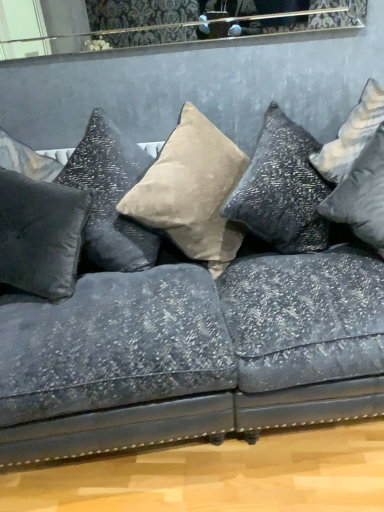
Question: From a real-world perspective, is satin black pillow at left, the fourth pillow in the right-to-left sequence, positioned under silver metallic pillow at right, which is counted as the fourth pillow, starting from the left, based on gravity?

Choices:
 (A) no
 (B) yes

Answer: (A)

Question: Is satin black pillow at left, the fourth pillow in the right-to-left sequence, bigger than silver metallic pillow at right, which appears as the 1th pillow when viewed from the right?

Choices:
 (A) yes
 (B) no

Answer: (A)

Question: From the image's perspective, is satin black pillow at left, which is counted as the first pillow, starting from the left, located above silver metallic pillow at right, which is counted as the fourth pillow, starting from the left?

Choices:
 (A) yes
 (B) no

Answer: (B)

Question: Can you confirm if satin black pillow at left, the fourth pillow in the right-to-left sequence, is smaller than silver metallic pillow at right, which appears as the 1th pillow when viewed from the right?

Choices:
 (A) yes
 (B) no

Answer: (B)

Question: Considering the relative sizes of satin black pillow at left, which is counted as the first pillow, starting from the left, and silver metallic pillow at right, which is counted as the fourth pillow, starting from the left, in the image provided, is satin black pillow at left, which is counted as the first pillow, starting from the left, wider than silver metallic pillow at right, which is counted as the fourth pillow, starting from the left,?

Choices:
 (A) no
 (B) yes

Answer: (A)

Question: Is silver metallic pillow at right, which is counted as the fourth pillow, starting from the left, to the left or to the right of suede beige pillow at center, which appears as the 2th pillow when viewed from the right, in the image?

Choices:
 (A) left
 (B) right

Answer: (B)

Question: Is silver metallic pillow at right, which is counted as the fourth pillow, starting from the left, wider or thinner than suede beige pillow at center, which appears as the 2th pillow when viewed from the right?

Choices:
 (A) thin
 (B) wide

Answer: (B)

Question: From a real-world perspective, is silver metallic pillow at right, which is counted as the fourth pillow, starting from the left, above or below suede beige pillow at center, which appears as the 2th pillow when viewed from the right?

Choices:
 (A) below
 (B) above

Answer: (A)

Question: Is silver metallic pillow at right, which is counted as the fourth pillow, starting from the left, spatially inside suede beige pillow at center, which appears as the 2th pillow when viewed from the right, or outside of it?

Choices:
 (A) inside
 (B) outside

Answer: (B)

Question: From the image's perspective, relative to satin black pillow at left, which is counted as the first pillow, starting from the left, is satin black pillow at center, the 2th pillow when ordered from left to right, above or below?

Choices:
 (A) below
 (B) above

Answer: (B)

Question: Considering the positions of satin black pillow at center, arranged as the 3th pillow when viewed from the right, and satin black pillow at left, which is counted as the first pillow, starting from the left, in the image, is satin black pillow at center, arranged as the 3th pillow when viewed from the right, bigger or smaller than satin black pillow at left, which is counted as the first pillow, starting from the left,?

Choices:
 (A) small
 (B) big

Answer: (B)

Question: Choose the correct answer: Is satin black pillow at center, the 2th pillow when ordered from left to right, inside satin black pillow at left, the fourth pillow in the right-to-left sequence, or outside it?

Choices:
 (A) outside
 (B) inside

Answer: (A)

Question: In the image, is satin black pillow at center, arranged as the 3th pillow when viewed from the right, on the left side or the right side of satin black pillow at left, which is counted as the first pillow, starting from the left?

Choices:
 (A) right
 (B) left

Answer: (A)

Question: Is point (205, 180) closer or farther from the camera than point (377, 222)?

Choices:
 (A) farther
 (B) closer

Answer: (A)

Question: Looking at their shapes, would you say suede beige pillow at center, which appears as the 2th pillow when viewed from the right, is wider or thinner than silver metallic pillow at right, which appears as the 1th pillow when viewed from the right?

Choices:
 (A) wide
 (B) thin

Answer: (B)